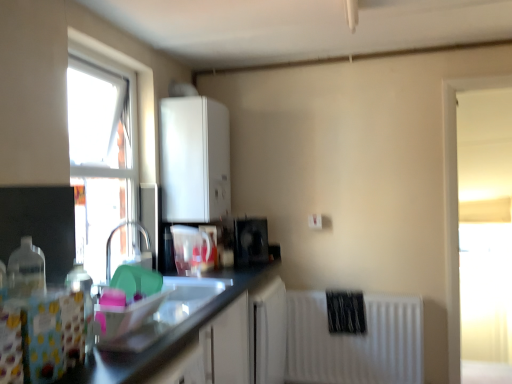
The width and height of the screenshot is (512, 384). In order to click on translucent plastic bottle at left in this screenshot , I will do `click(83, 299)`.

Image resolution: width=512 pixels, height=384 pixels. What do you see at coordinates (355, 342) in the screenshot?
I see `white matte radiator at lower right` at bounding box center [355, 342].

Where is `transparent glass window at right, marked as the second window in a left-to-right arrangement`? The height and width of the screenshot is (384, 512). transparent glass window at right, marked as the second window in a left-to-right arrangement is located at coordinates (456, 205).

What do you see at coordinates (192, 250) in the screenshot? The width and height of the screenshot is (512, 384). I see `transparent plastic pitcher at center, the 2th appliance from the back` at bounding box center [192, 250].

At what (x,y) coordinates should I click in order to perform the action: click on transparent plastic pitcher at center, which is counted as the 1th appliance, starting from the left. Please return your answer as a coordinate pair (x, y). The image size is (512, 384). Looking at the image, I should click on (192, 250).

This screenshot has height=384, width=512. In order to click on matte black sink at center in this screenshot , I will do `click(161, 311)`.

Which point is more forward, (456, 259) or (183, 272)?

The point (183, 272) is in front.

Could you tell me if transparent glass window at right, which is the 1th window in back-to-front order, is turned towards transparent plastic pitcher at center, which is counted as the 1th appliance, starting from the left?

No.

From a real-world perspective, which object stands above the other?

transparent glass window at right, which appears as the 1th window when viewed from the right.

Is transparent glass window at upper left, which ranks as the 2th window in right-to-left order, smaller than translucent plastic bottle at left?

No.

Is transparent glass window at upper left, which ranks as the 2th window in right-to-left order, facing towards translucent plastic bottle at left?

No, transparent glass window at upper left, which ranks as the 2th window in right-to-left order, is not oriented towards translucent plastic bottle at left.

Considering the sizes of objects transparent glass window at upper left, placed as the first window when sorted from front to back, and translucent plastic bottle at left in the image provided, who is taller, transparent glass window at upper left, placed as the first window when sorted from front to back, or translucent plastic bottle at left?

transparent glass window at upper left, placed as the first window when sorted from front to back, is taller.

From the image's perspective, which is above, transparent glass window at upper left, which ranks as the second window in back-to-front order, or translucent plastic bottle at left?

transparent glass window at upper left, which ranks as the second window in back-to-front order, from the image's perspective.

Considering the relative positions of black glossy speaker at center, the 2th appliance in the left-to-right sequence, and white matte cabinet at upper center in the image provided, is black glossy speaker at center, the 2th appliance in the left-to-right sequence, behind white matte cabinet at upper center?

Yes, it is.

Considering the relative sizes of black glossy speaker at center, the 2th appliance when ordered from front to back, and white matte cabinet at upper center in the image provided, is black glossy speaker at center, the 2th appliance when ordered from front to back, wider than white matte cabinet at upper center?

Incorrect, the width of black glossy speaker at center, the 2th appliance when ordered from front to back, does not surpass that of white matte cabinet at upper center.

Who is smaller, black glossy speaker at center, marked as the first appliance in a right-to-left arrangement, or white matte cabinet at upper center?

With smaller size is black glossy speaker at center, marked as the first appliance in a right-to-left arrangement.

Does point (260, 238) appear closer or farther from the camera than point (226, 151)?

Point (260, 238) appears to be closer to the viewer than point (226, 151).

Considering the relative sizes of transparent glass window at right, which is the 1th window in back-to-front order, and white matte radiator at lower right in the image provided, is transparent glass window at right, which is the 1th window in back-to-front order, taller than white matte radiator at lower right?

Correct, transparent glass window at right, which is the 1th window in back-to-front order, is much taller as white matte radiator at lower right.

Based on the photo, could you measure the distance between transparent glass window at right, placed as the 2th window when sorted from front to back, and white matte radiator at lower right?

transparent glass window at right, placed as the 2th window when sorted from front to back, and white matte radiator at lower right are 63.70 centimeters apart from each other.

Considering the sizes of transparent glass window at right, which appears as the 1th window when viewed from the right, and white matte radiator at lower right in the image, is transparent glass window at right, which appears as the 1th window when viewed from the right, bigger or smaller than white matte radiator at lower right?

Considering their sizes, transparent glass window at right, which appears as the 1th window when viewed from the right, takes up more space than white matte radiator at lower right.

Which is behind, transparent glass window at right, marked as the second window in a left-to-right arrangement, or white matte radiator at lower right?

white matte radiator at lower right is behind.

Can you tell me how much matte black sink at center and transparent glass window at right, which is the 1th window in back-to-front order, differ in facing direction?

The facing directions of matte black sink at center and transparent glass window at right, which is the 1th window in back-to-front order, are 90 degrees apart.

Is matte black sink at center situated inside transparent glass window at right, which appears as the 1th window when viewed from the right, or outside?

matte black sink at center is not inside transparent glass window at right, which appears as the 1th window when viewed from the right, it's outside.

At what (x,y) coordinates should I click in order to perform the action: click on sink below the transparent glass window at right, which is the 1th window in back-to-front order (from a real-world perspective). Please return your answer as a coordinate pair (x, y). Looking at the image, I should click on (x=161, y=311).

In terms of size, does transparent glass window at right, which is the 1th window in back-to-front order, appear bigger or smaller than white matte cabinet at upper center?

transparent glass window at right, which is the 1th window in back-to-front order, is smaller than white matte cabinet at upper center.

Which object is further away from the camera, transparent glass window at right, marked as the second window in a left-to-right arrangement, or white matte cabinet at upper center?

Positioned behind is transparent glass window at right, marked as the second window in a left-to-right arrangement.

From the image's perspective, who appears lower, transparent glass window at right, marked as the second window in a left-to-right arrangement, or white matte cabinet at upper center?

transparent glass window at right, marked as the second window in a left-to-right arrangement, is shown below in the image.

Is there a large distance between transparent glass window at right, placed as the 2th window when sorted from front to back, and white matte cabinet at upper center?

Indeed, transparent glass window at right, placed as the 2th window when sorted from front to back, is not near white matte cabinet at upper center.

Can you tell me how much white matte cabinet at upper center and translucent plastic bottle at left differ in facing direction?

The angle between the facing direction of white matte cabinet at upper center and the facing direction of translucent plastic bottle at left is 0.000753 degrees.

Does white matte cabinet at upper center lie behind translucent plastic bottle at left?

Yes.

Which object is positioned more to the right, white matte cabinet at upper center or translucent plastic bottle at left?

white matte cabinet at upper center.

Does point (159, 114) come in front of point (86, 306)?

That is False.

Locate an element on the screen. The image size is (512, 384). the 1st window above the transparent plastic pitcher at center, the 2th appliance from the back (from a real-world perspective) is located at coordinates (456, 205).

What are the coordinates of `the 1st window behind when counting from the translucent plastic bottle at left` in the screenshot? It's located at (103, 140).

From the image, which object appears to be nearer to transparent glass window at upper left, placed as the first window when sorted from front to back, white matte radiator at lower right or black glossy speaker at center, marked as the first appliance in a right-to-left arrangement?

black glossy speaker at center, marked as the first appliance in a right-to-left arrangement, lies closer to transparent glass window at upper left, placed as the first window when sorted from front to back, than the other object.

Looking at the image, which one is located closer to transparent glass window at upper left, the first window viewed from the left, matte black sink at center or white matte radiator at lower right?

matte black sink at center is closer to transparent glass window at upper left, the first window viewed from the left.

Estimate the real-world distances between objects in this image. Which object is closer to white matte cabinet at upper center, translucent plastic bottle at left or white matte radiator at lower right?

The object closer to white matte cabinet at upper center is white matte radiator at lower right.

Based on their spatial positions, is matte black sink at center or transparent glass window at right, marked as the second window in a left-to-right arrangement, further from transparent glass window at upper left, which ranks as the 2th window in right-to-left order?

transparent glass window at right, marked as the second window in a left-to-right arrangement, is positioned further to the anchor transparent glass window at upper left, which ranks as the 2th window in right-to-left order.

From the image, which object appears to be farther from transparent glass window at upper left, which ranks as the second window in back-to-front order, white matte radiator at lower right or transparent glass window at right, placed as the 2th window when sorted from front to back?

Among the two, transparent glass window at right, placed as the 2th window when sorted from front to back, is located further to transparent glass window at upper left, which ranks as the second window in back-to-front order.

Considering their positions, is translucent plastic bottle at left positioned closer to white matte cabinet at upper center than transparent glass window at right, marked as the second window in a left-to-right arrangement?

translucent plastic bottle at left is closer to white matte cabinet at upper center.

From the image, which object appears to be farther from transparent plastic pitcher at center, which is counted as the 1th appliance, starting from the left, transparent glass window at upper left, which ranks as the second window in back-to-front order, or white matte radiator at lower right?

white matte radiator at lower right.

From the image, which object appears to be farther from transparent plastic pitcher at center, which is the 2th appliance from right to left, translucent plastic bottle at left or transparent glass window at right, which is the 1th window in back-to-front order?

The object further to transparent plastic pitcher at center, which is the 2th appliance from right to left, is transparent glass window at right, which is the 1th window in back-to-front order.

You are a GUI agent. You are given a task and a screenshot of the screen. Output one action in this format:
    pyautogui.click(x=<x>, y=<y>)
    Task: Click on the appliance between white matte cabinet at upper center and transparent glass window at right, which is the 1th window in back-to-front order, from left to right
    The height and width of the screenshot is (384, 512).
    Given the screenshot: What is the action you would take?
    pyautogui.click(x=251, y=241)

Find the location of `radiator between translucent plastic bottle at left and transparent glass window at right, marked as the second window in a left-to-right arrangement`. radiator between translucent plastic bottle at left and transparent glass window at right, marked as the second window in a left-to-right arrangement is located at coordinates (355, 342).

Identify the location of appliance between matte black sink at center and black glossy speaker at center, marked as the first appliance in a right-to-left arrangement, from front to back. (192, 250).

Identify the location of appliance between translucent plastic bottle at left and black glossy speaker at center, the 2th appliance when ordered from front to back, in the front-back direction. The height and width of the screenshot is (384, 512). (192, 250).